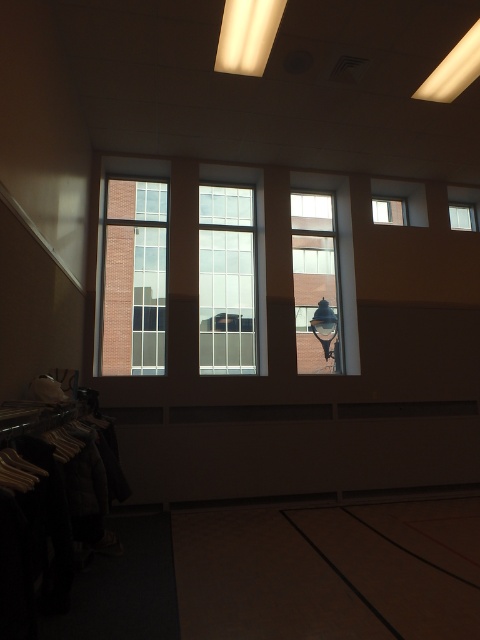
Looking at this image, you are designing a layout for a new gym and want to ensure that the brick wall at left and the clear glass window at upper right are proportionally balanced. Given their widths, which object should you consider adjusting to achieve better symmetry?

The brick wall at left is wider than the clear glass window at upper right. To achieve better symmetry, you should consider adjusting the width of the brick wall at left to match the clear glass window at upper right.

You are standing at the entrance of the gymnasium and see two points marked on the floor. The first point is at position point (144, 246) and the second point is at point (391, 221). If you were to walk towards the second point, would you pass by the first point?

Yes, because point (144, 246) is in front of point (391, 221), so walking towards the second point would require passing the first point.